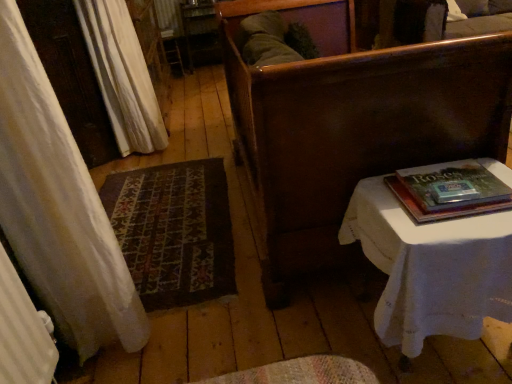
Question: Relative to white fabric curtain at upper left, is hardcover book at right in front or behind?

Choices:
 (A) behind
 (B) front

Answer: (B)

Question: From a real-world perspective, is hardcover book at right physically located above or below white fabric curtain at upper left?

Choices:
 (A) above
 (B) below

Answer: (A)

Question: Based on their relative distances, which object is farther from the dark brown wood bench at center?

Choices:
 (A) hardcover book at right
 (B) white cloth-covered table at right
 (C) white fabric curtain at upper left

Answer: (C)

Question: Estimate the real-world distances between objects in this image. Which object is closer to the dark brown wood bench at center?

Choices:
 (A) hardcover book at right
 (B) white cloth-covered table at right
 (C) white fabric curtain at upper left

Answer: (A)